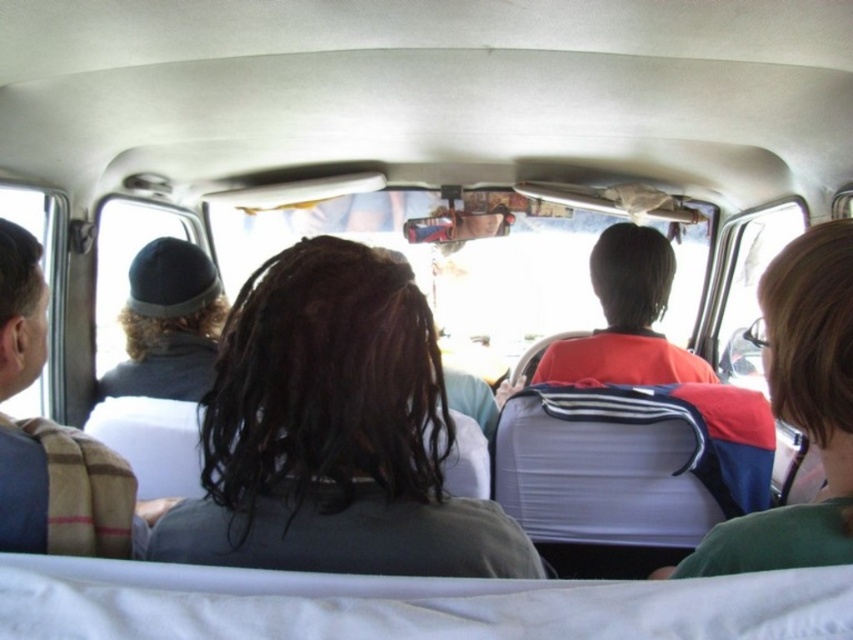
Question: Does red and blue backpack at center appear on the left side of red matte shirt at center?

Choices:
 (A) no
 (B) yes

Answer: (B)

Question: Which point is farther to the camera?

Choices:
 (A) dark brown hair at center
 (B) dark gray knit cap at left
 (C) red matte shirt at center

Answer: (B)

Question: Can you confirm if dark brown hair at center is thinner than red and blue backpack at center?

Choices:
 (A) no
 (B) yes

Answer: (A)

Question: Estimate the real-world distances between objects in this image. Which object is closer to the red matte shirt at center?

Choices:
 (A) dark brown hair at center
 (B) dark gray knit cap at left
 (C) red and blue backpack at center

Answer: (C)

Question: Which point is closer to the camera?

Choices:
 (A) (550, 353)
 (B) (141, 262)
 (C) (381, 378)

Answer: (C)

Question: Does dark brown hair at center come behind red matte shirt at center?

Choices:
 (A) yes
 (B) no

Answer: (B)